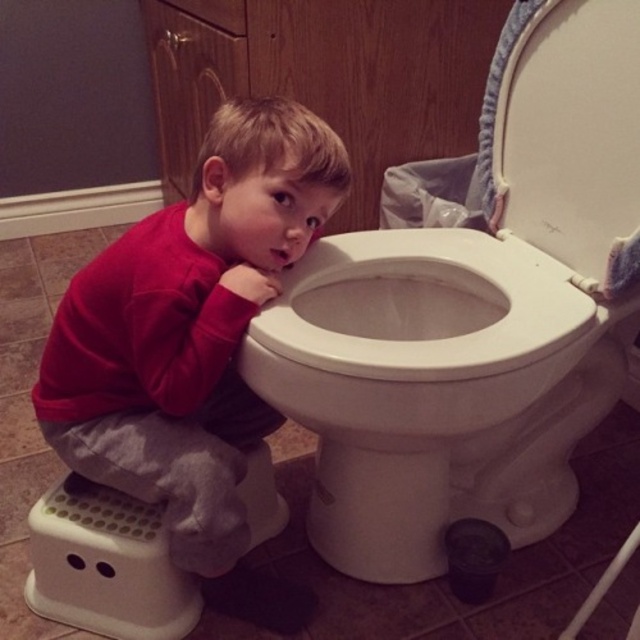
Question: Which of these objects is positioned closest to the red fleece shirt at center?

Choices:
 (A) white glossy toilet bowl at center
 (B) white plastic step stool at lower left

Answer: (B)

Question: Which point is closer to the camera?

Choices:
 (A) (156, 582)
 (B) (577, 291)

Answer: (B)

Question: Can you confirm if white glossy toilet bowl at center is smaller than white plastic step stool at lower left?

Choices:
 (A) yes
 (B) no

Answer: (B)

Question: Is red fleece shirt at center smaller than white plastic step stool at lower left?

Choices:
 (A) yes
 (B) no

Answer: (B)

Question: Considering the relative positions of white glossy toilet bowl at center and white plastic step stool at lower left in the image provided, where is white glossy toilet bowl at center located with respect to white plastic step stool at lower left?

Choices:
 (A) below
 (B) above

Answer: (B)

Question: Which of the following is the farthest from the observer?

Choices:
 (A) (182, 582)
 (B) (129, 324)
 (C) (488, 428)

Answer: (A)